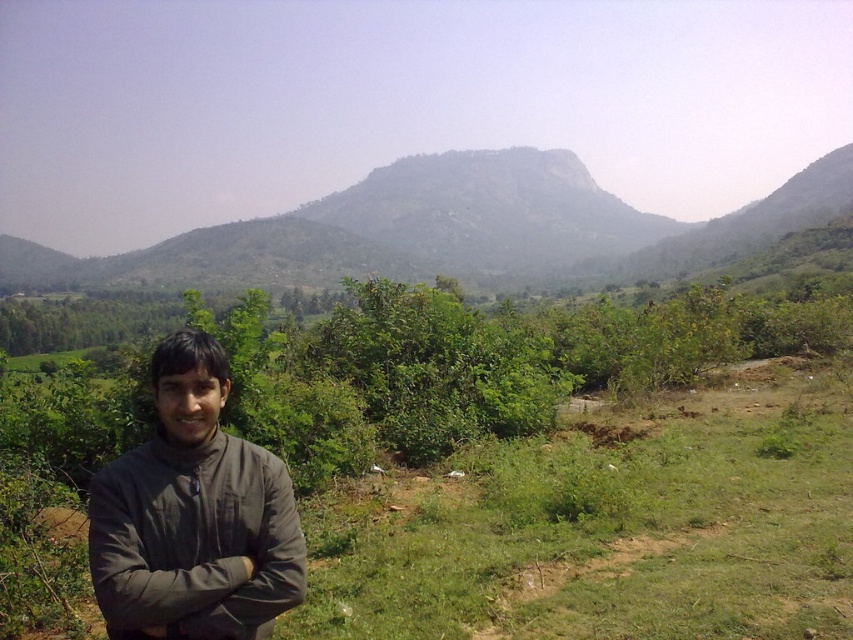
Question: Can you confirm if green textured mountain at center is positioned above dark gray jacket at lower left?

Choices:
 (A) yes
 (B) no

Answer: (A)

Question: Is green textured mountain at center positioned before dark gray jacket at lower left?

Choices:
 (A) no
 (B) yes

Answer: (A)

Question: Can you confirm if green textured mountain at center is positioned above dark gray jacket at lower left?

Choices:
 (A) no
 (B) yes

Answer: (B)

Question: Which of the following is the farthest from the observer?

Choices:
 (A) green textured mountain at center
 (B) dark gray jacket at lower left

Answer: (A)